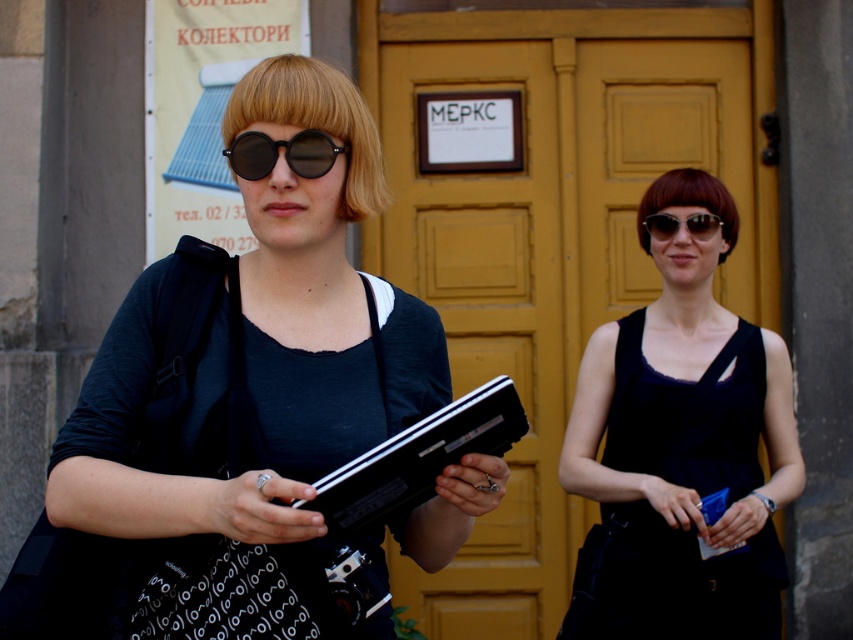
Is point (368, 276) more distant than point (273, 160)?

That is True.

Between point (315, 376) and point (294, 154), which one is positioned behind?

Point (315, 376)

Where is `matte black laptop at left`? matte black laptop at left is located at coordinates (258, 381).

Does matte black laptop at left have a lesser width compared to sunglasses at center?

Incorrect, matte black laptop at left's width is not less than sunglasses at center's.

Is matte black laptop at left positioned behind sunglasses at center?

No, it is in front of sunglasses at center.

Is point (141, 508) more distant than point (695, 220)?

No, it is not.

Identify the location of matte black laptop at left. (258, 381).

Between matte black laptop at left and black matte dress at center, which one appears on the left side from the viewer's perspective?

matte black laptop at left

Is matte black laptop at left to the right of black matte dress at center from the viewer's perspective?

No, matte black laptop at left is not to the right of black matte dress at center.

Is point (235, 529) positioned after point (682, 273)?

No, it is in front of (682, 273).

This screenshot has height=640, width=853. What are the coordinates of `matte black laptop at left` in the screenshot? It's located at (258, 381).